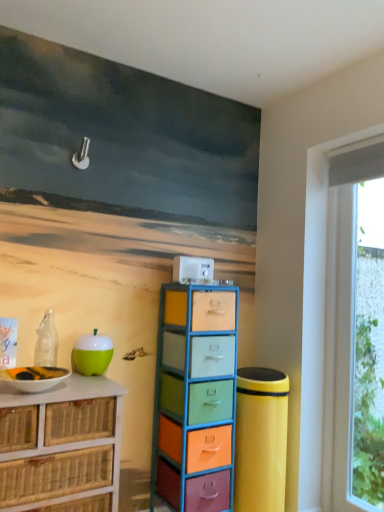
Question: From the image's perspective, is multicolored plastic drawers at center, which appears as the 1th chest of drawers when viewed from the right, above transparent glass window at right?

Choices:
 (A) no
 (B) yes

Answer: (A)

Question: Does multicolored plastic drawers at center, arranged as the 2th chest of drawers when viewed from the left, have a greater width compared to transparent glass window at right?

Choices:
 (A) yes
 (B) no

Answer: (A)

Question: Does multicolored plastic drawers at center, which appears as the 1th chest of drawers when viewed from the right, lie in front of transparent glass window at right?

Choices:
 (A) no
 (B) yes

Answer: (B)

Question: Is multicolored plastic drawers at center, which appears as the 1th chest of drawers when viewed from the right, far away from transparent glass window at right?

Choices:
 (A) yes
 (B) no

Answer: (B)

Question: Can transparent glass window at right be found inside multicolored plastic drawers at center, which appears as the 1th chest of drawers when viewed from the right?

Choices:
 (A) yes
 (B) no

Answer: (B)

Question: Is multicolored plastic drawers at center, arranged as the 2th chest of drawers when viewed from the left, not inside transparent glass window at right?

Choices:
 (A) no
 (B) yes

Answer: (B)

Question: From the image's perspective, is transparent glass window at right on top of white glossy bowl at lower left?

Choices:
 (A) no
 (B) yes

Answer: (A)

Question: Is transparent glass window at right not near white glossy bowl at lower left?

Choices:
 (A) yes
 (B) no

Answer: (A)

Question: Could you tell me if transparent glass window at right is facing white glossy bowl at lower left?

Choices:
 (A) yes
 (B) no

Answer: (A)

Question: Is transparent glass window at right positioned beyond the bounds of white glossy bowl at lower left?

Choices:
 (A) yes
 (B) no

Answer: (A)

Question: Is transparent glass window at right with white glossy bowl at lower left?

Choices:
 (A) no
 (B) yes

Answer: (A)

Question: Is transparent glass window at right positioned before white glossy bowl at lower left?

Choices:
 (A) no
 (B) yes

Answer: (A)

Question: Does transparent glass window at right have a larger size compared to multicolored plastic drawers at center, which appears as the 1th chest of drawers when viewed from the right?

Choices:
 (A) yes
 (B) no

Answer: (B)